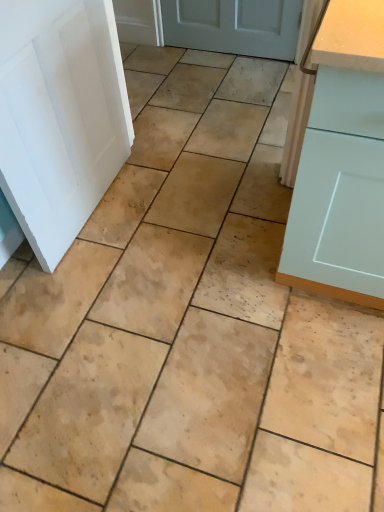
In order to click on free space between white matte door at left and light blue matte cabinet at right in this screenshot , I will do [x=187, y=227].